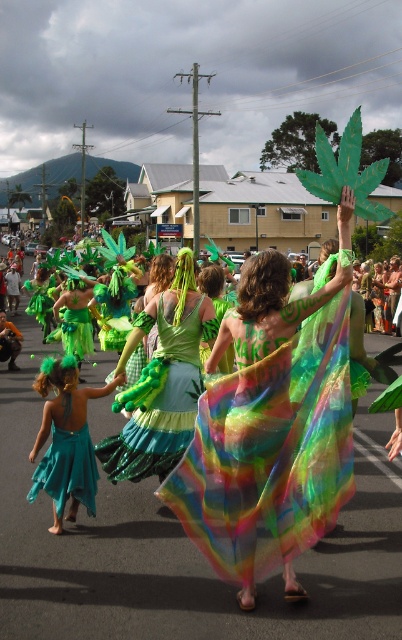
Question: Does rainbow tulle dress at center appear on the left side of teal satin skirt at lower left?

Choices:
 (A) no
 (B) yes

Answer: (A)

Question: Does rainbow tulle dress at center lie in front of teal satin skirt at lower left?

Choices:
 (A) yes
 (B) no

Answer: (A)

Question: Which object is positioned closest to the rainbow tulle dress at center?

Choices:
 (A) rainbow sheer fabric at center
 (B) green satin dress at center
 (C) teal satin skirt at lower left

Answer: (C)

Question: Where is rainbow sheer fabric at center located in relation to green satin dress at center in the image?

Choices:
 (A) right
 (B) left

Answer: (A)

Question: Based on their relative distances, which object is nearer to the teal satin skirt at lower left?

Choices:
 (A) green satin dress at center
 (B) teal chiffon dress at lower left
 (C) rainbow tulle dress at center
 (D) rainbow sheer fabric at center

Answer: (B)

Question: Which of these objects is positioned closest to the rainbow tulle dress at center?

Choices:
 (A) teal satin skirt at lower left
 (B) green satin dress at center

Answer: (A)